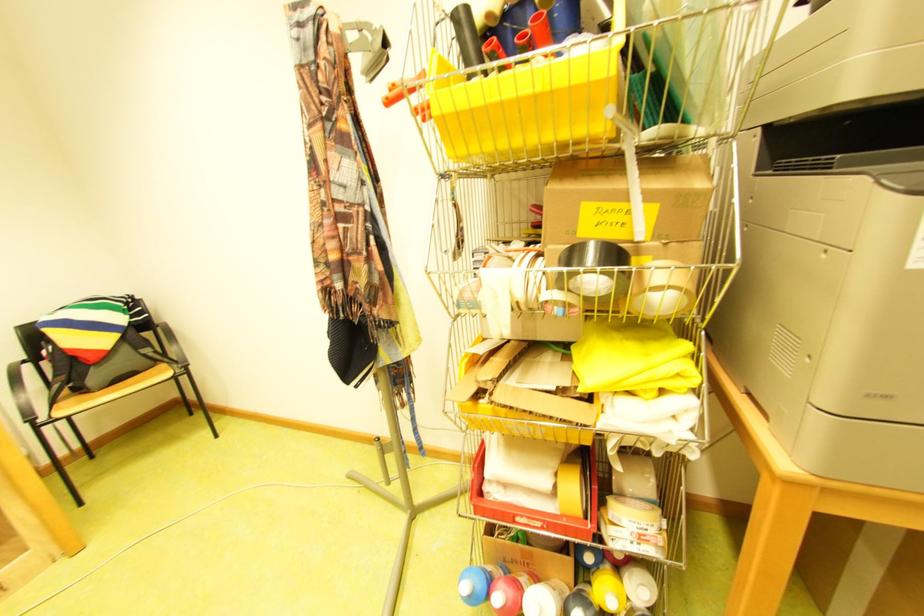
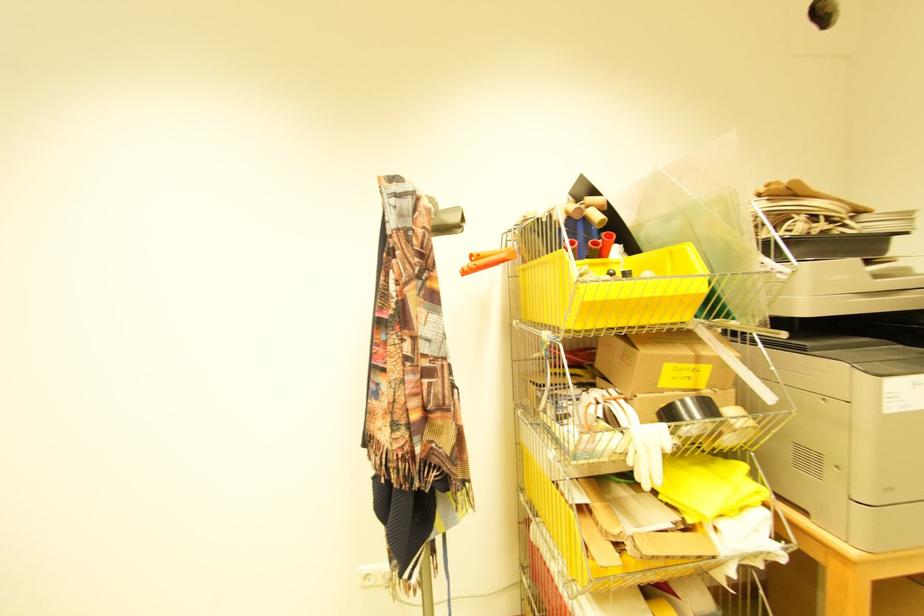
The point at (407, 86) is marked in the first image. Where is the corresponding point in the second image?

(492, 254)